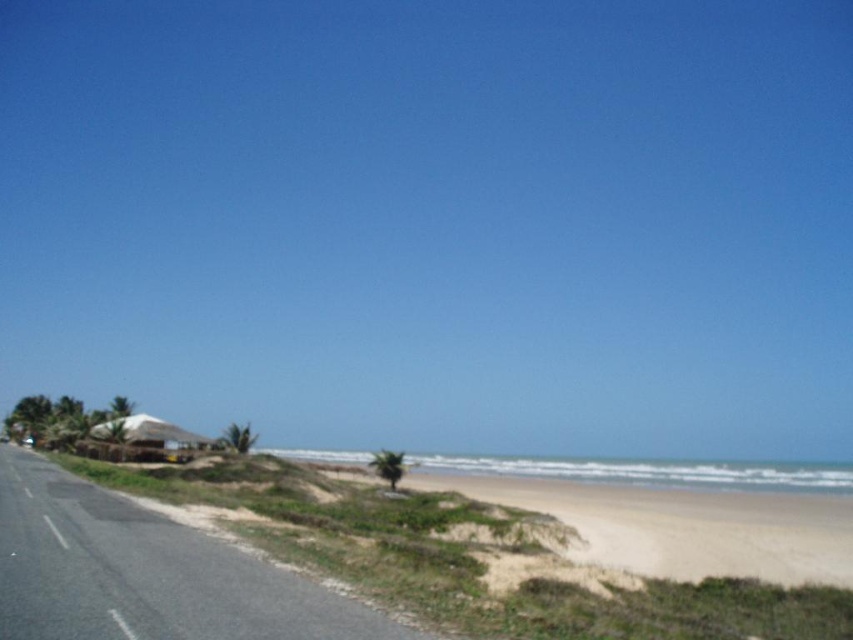
Question: Does light beige sand at lower right appear under white thatched hut at lower left?

Choices:
 (A) yes
 (B) no

Answer: (A)

Question: Does light beige sand at lower right have a greater width compared to white thatched hut at lower left?

Choices:
 (A) no
 (B) yes

Answer: (B)

Question: Which object appears closest to the camera in this image?

Choices:
 (A) white thatched hut at lower left
 (B) light beige sand at lower right

Answer: (B)

Question: Among these objects, which one is nearest to the camera?

Choices:
 (A) white thatched hut at lower left
 (B) light beige sand at lower right

Answer: (B)

Question: Is light beige sand at lower right to the left of white thatched hut at lower left from the viewer's perspective?

Choices:
 (A) yes
 (B) no

Answer: (B)